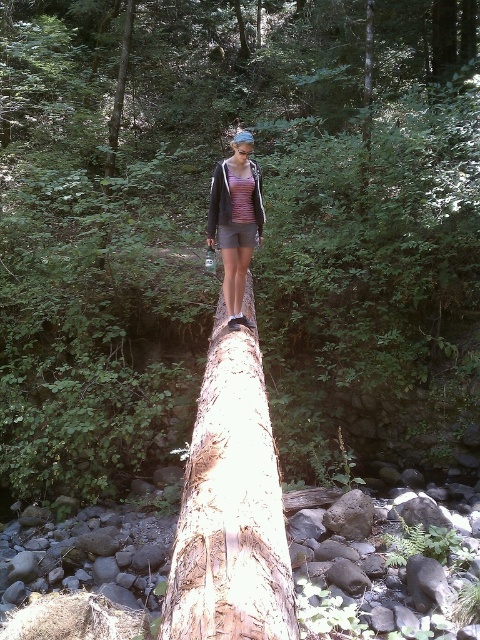
Is light brown rough tree trunk at center to the left of matte purple tank top at center from the viewer's perspective?

Yes, light brown rough tree trunk at center is to the left of matte purple tank top at center.

Who is more distant from viewer, (192, 529) or (244, 228)?

Point (244, 228)

The height and width of the screenshot is (640, 480). I want to click on light brown rough tree trunk at center, so click(230, 508).